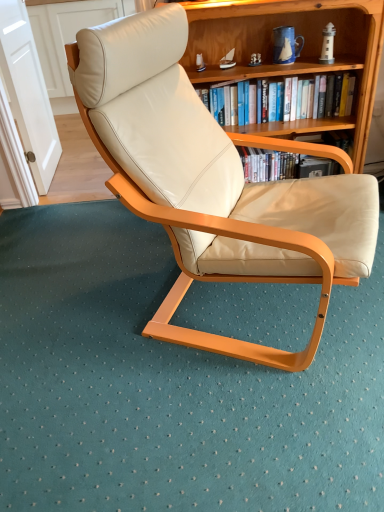
You are a GUI agent. You are given a task and a screenshot of the screen. Output one action in this format:
    pyautogui.click(x=<x>, y=<y>)
    Task: Click on the free space on the front side of matte cream leather chair at center
    
    Given the screenshot: What is the action you would take?
    pyautogui.click(x=230, y=425)